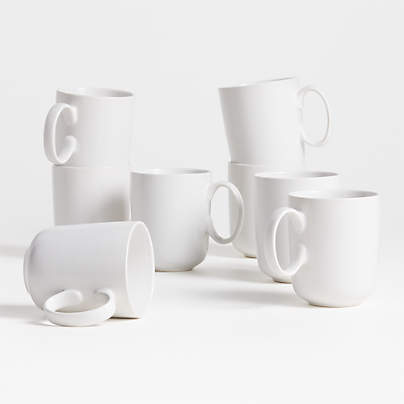
You are a GUI agent. You are given a task and a screenshot of the screen. Output one action in this format:
    pyautogui.click(x=<x>, y=<y>)
    Task: Click on the mugs touching the table
    
    Given the screenshot: What is the action you would take?
    pyautogui.click(x=79, y=192), pyautogui.click(x=151, y=201), pyautogui.click(x=243, y=179), pyautogui.click(x=273, y=204), pyautogui.click(x=332, y=239), pyautogui.click(x=83, y=250)